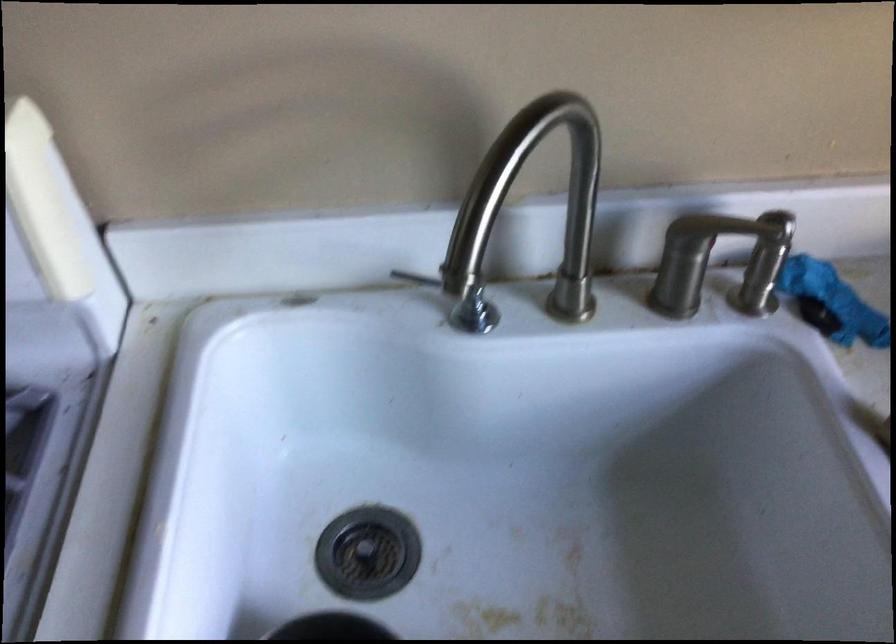
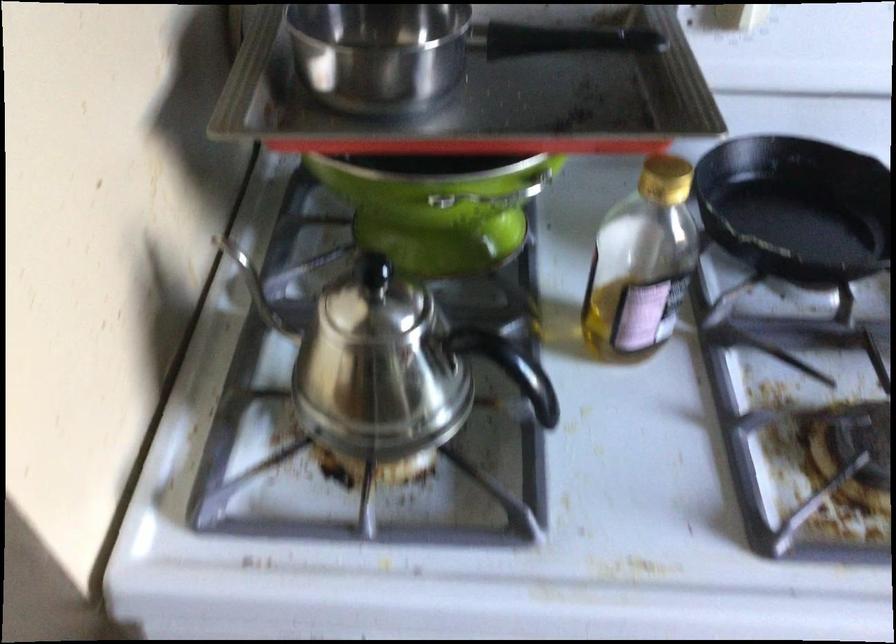
Question: The camera is either moving clockwise (left) or counter-clockwise (right) around the object. The first image is from the beginning of the video and the second image is from the end. Is the camera moving left or right when shooting the video?

Choices:
 (A) Left
 (B) Right

Answer: (B)